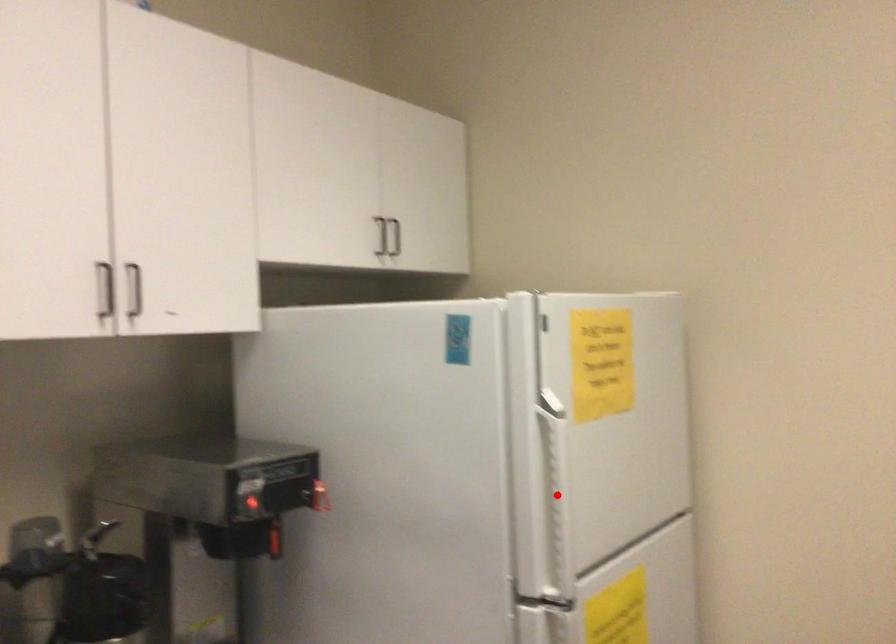
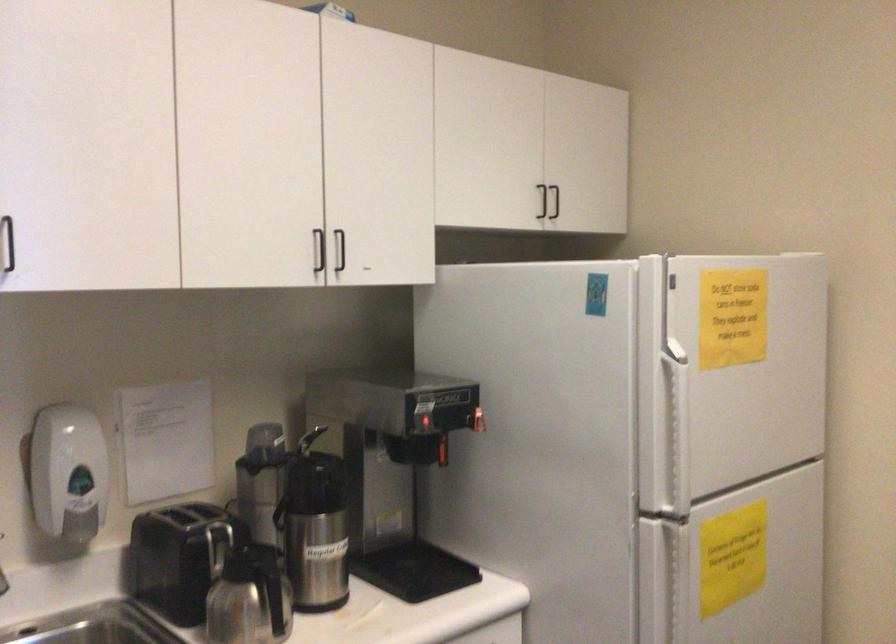
Question: A red point is marked in image1. In image2, is the corresponding 3D point closer to the camera or farther? Reply with the corresponding letter.

Choices:
 (A) The corresponding 3D point is closer.
 (B) The corresponding 3D point is farther.

Answer: (B)